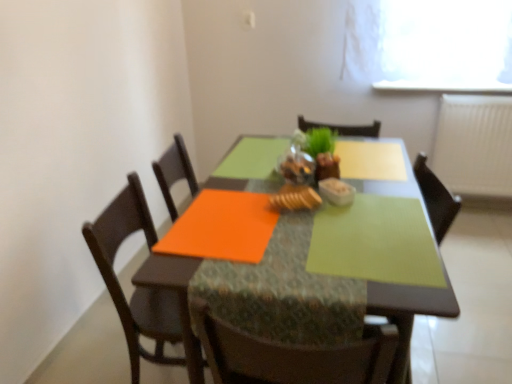
This screenshot has width=512, height=384. I want to click on baked golden bread at center, so click(x=295, y=198).

You are a GUI agent. You are given a task and a screenshot of the screen. Output one action in this format:
    pyautogui.click(x=<x>, y=<y>)
    Task: Click on the white textured radiator at right
    Image resolution: width=512 pixels, height=384 pixels.
    Given the screenshot: What is the action you would take?
    pyautogui.click(x=474, y=145)

At what (x,y) coordinates should I click in order to perform the action: click on green matte houseplant at center. Please return your answer as a coordinate pair (x, y). This screenshot has height=384, width=512. Looking at the image, I should click on (323, 152).

This screenshot has width=512, height=384. What do you see at coordinates (375, 242) in the screenshot?
I see `green matte placemat at center` at bounding box center [375, 242].

Image resolution: width=512 pixels, height=384 pixels. What do you see at coordinates (137, 287) in the screenshot?
I see `wooden chair at left` at bounding box center [137, 287].

Locate an element on the screen. Image resolution: width=512 pixels, height=384 pixels. baked golden bread at center is located at coordinates (295, 198).

Consider the image. Can you confirm if white glossy bowl at center is bigger than green matte placemat at center?

Incorrect, white glossy bowl at center is not larger than green matte placemat at center.

Considering the positions of objects white glossy bowl at center and green matte placemat at center in the image provided, who is more to the right, white glossy bowl at center or green matte placemat at center?

Positioned to the right is green matte placemat at center.

Is point (346, 201) positioned in front of point (406, 303)?

No, (346, 201) is further to viewer.

Does white glossy bowl at center lie in front of green matte placemat at center?

No.

From the picture: In terms of width, does baked golden bread at center look wider or thinner when compared to wooden chair at left?

Considering their sizes, baked golden bread at center looks slimmer than wooden chair at left.

From a real-world perspective, is baked golden bread at center positioned above or below wooden chair at left?

In terms of real-world spatial position, baked golden bread at center is above wooden chair at left.

Is baked golden bread at center not close to wooden chair at left?

No, there isn't a large distance between baked golden bread at center and wooden chair at left.

Which is in front, wooden chair at left or baked golden bread at center?

wooden chair at left is in front.

In the scene shown: Who is shorter, wooden chair at left or baked golden bread at center?

With less height is baked golden bread at center.

Is point (123, 215) more distant than point (314, 202)?

Yes, point (123, 215) is behind point (314, 202).

From a real-world perspective, relative to green matte placemat at center, is white textured radiator at right vertically above or below?

white textured radiator at right is below green matte placemat at center.

What's the angular difference between white textured radiator at right and green matte placemat at center's facing directions?

white textured radiator at right and green matte placemat at center are facing 91.5 degrees away from each other.

Which is further, [483,193] or [407,256]?

Positioned behind is point [483,193].

Is white textured radiator at right turned away from green matte placemat at center?

That's not correct — white textured radiator at right is not looking away from green matte placemat at center.

What's the angular difference between white textured radiator at right and matte glass table at center's facing directions?

There is a 91.5-degree angle between the facing directions of white textured radiator at right and matte glass table at center.

Is white textured radiator at right taller than matte glass table at center?

Incorrect, the height of white textured radiator at right is not larger of that of matte glass table at center.

Is white textured radiator at right oriented away from matte glass table at center?

No.

From the image's perspective, between white textured radiator at right and matte glass table at center, which one is located above?

From the image's view, white textured radiator at right is above.

From a real-world perspective, is white textured radiator at right below white glossy bowl at center?

Yes.

Can you confirm if white textured radiator at right is shorter than white glossy bowl at center?

No, white textured radiator at right is not shorter than white glossy bowl at center.

Does point (449, 170) come farther from viewer compared to point (334, 195)?

Yes, it is behind point (334, 195).

From a real-world perspective, is green matte placemat at center located beneath white textured radiator at right?

No, from a real-world perspective, green matte placemat at center is not below white textured radiator at right.

Considering the positions of objects green matte placemat at center and white textured radiator at right in the image provided, who is more to the right, green matte placemat at center or white textured radiator at right?

From the viewer's perspective, white textured radiator at right appears more on the right side.

Choose the correct answer: Is green matte placemat at center inside white textured radiator at right or outside it?

green matte placemat at center is located beyond the bounds of white textured radiator at right.

How many degrees apart are the facing directions of green matte placemat at center and white textured radiator at right?

The facing directions of green matte placemat at center and white textured radiator at right are 91.5 degrees apart.

The width and height of the screenshot is (512, 384). I want to click on tableware on the left of the green matte placemat at center, so click(x=336, y=191).

In the image, there is a wooden chair at left. At what (x,y) coordinates should I click in order to perform the action: click on food above it (from the image's perspective). Please return your answer as a coordinate pair (x, y). This screenshot has width=512, height=384. Looking at the image, I should click on (295, 198).

Based on their spatial positions, is green matte houseplant at center or white textured radiator at right closer to wooden chair at left?

green matte houseplant at center is positioned closer to the anchor wooden chair at left.

Based on the photo, considering their positions, is baked golden bread at center positioned further to white glossy bowl at center than green matte houseplant at center?

Based on the image, green matte houseplant at center appears to be further to white glossy bowl at center.

Based on their spatial positions, is wooden chair at left or white textured radiator at right closer to green matte placemat at center?

Among the two, wooden chair at left is located nearer to green matte placemat at center.

Estimate the real-world distances between objects in this image. Which object is closer to green matte houseplant at center, green matte placemat at center or baked golden bread at center?

The object closer to green matte houseplant at center is baked golden bread at center.

In the scene shown: Based on their spatial positions, is green matte houseplant at center or white glossy bowl at center closer to baked golden bread at center?

white glossy bowl at center lies closer to baked golden bread at center than the other object.

Considering their positions, is white glossy bowl at center positioned closer to matte glass table at center than green matte houseplant at center?

white glossy bowl at center lies closer to matte glass table at center than the other object.

Considering their positions, is matte glass table at center positioned closer to wooden chair at left than green matte placemat at center?

matte glass table at center.

From the picture: Which object lies nearer to the anchor point white textured radiator at right, green matte houseplant at center or green matte placemat at center?

green matte houseplant at center is closer to white textured radiator at right.

This screenshot has height=384, width=512. I want to click on tableware located between green matte placemat at center and green matte houseplant at center in the depth direction, so click(x=336, y=191).

At what (x,y) coordinates should I click in order to perform the action: click on kitchen & dining room table situated between wooden chair at left and white glossy bowl at center from left to right. Please return your answer as a coordinate pair (x, y). The image size is (512, 384). Looking at the image, I should click on (409, 313).

Where is `armchair between matte glass table at center and green matte houseplant at center along the z-axis`? armchair between matte glass table at center and green matte houseplant at center along the z-axis is located at coordinates (408, 316).

At what (x,y) coordinates should I click in order to perform the action: click on food between wooden chair at left and matte glass table at center in the horizontal direction. Please return your answer as a coordinate pair (x, y). Image resolution: width=512 pixels, height=384 pixels. Looking at the image, I should click on (295, 198).